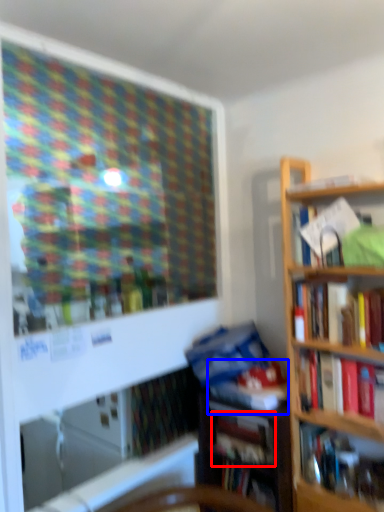
Question: Which point is closer to the camera, book (highlighted by a red box) or book (highlighted by a blue box)?

Choices:
 (A) book
 (B) book

Answer: (B)